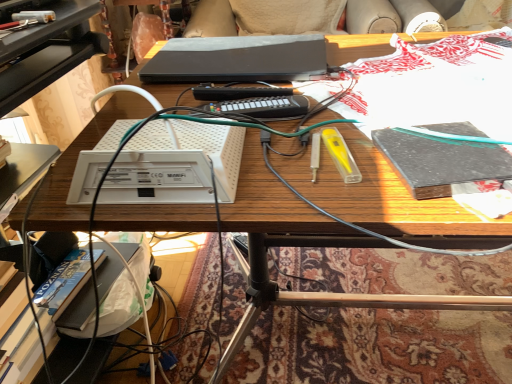
Question: Can you confirm if white plastic router at center is shorter than black matte book at right?

Choices:
 (A) no
 (B) yes

Answer: (A)

Question: Does white plastic router at center come in front of black matte book at right?

Choices:
 (A) yes
 (B) no

Answer: (A)

Question: Considering the relative sizes of white plastic router at center and black matte book at right in the image provided, is white plastic router at center wider than black matte book at right?

Choices:
 (A) no
 (B) yes

Answer: (B)

Question: Can you confirm if white plastic router at center is positioned to the right of black matte book at right?

Choices:
 (A) no
 (B) yes

Answer: (A)

Question: Is black matte book at right at the back of white plastic router at center?

Choices:
 (A) yes
 (B) no

Answer: (B)

Question: Could you tell me if white plastic router at center is turned towards black matte book at right?

Choices:
 (A) yes
 (B) no

Answer: (B)

Question: Is black matte book at right smaller than black matte laptop at center?

Choices:
 (A) no
 (B) yes

Answer: (B)

Question: Does black matte book at right lie in front of black matte laptop at center?

Choices:
 (A) yes
 (B) no

Answer: (A)

Question: Is black matte book at right oriented towards black matte laptop at center?

Choices:
 (A) yes
 (B) no

Answer: (B)

Question: From the image's perspective, does black matte book at right appear lower than black matte laptop at center?

Choices:
 (A) no
 (B) yes

Answer: (B)

Question: Is black matte book at right further to the viewer compared to black matte laptop at center?

Choices:
 (A) no
 (B) yes

Answer: (A)

Question: Considering the relative positions of black matte book at right and black matte laptop at center in the image provided, is black matte book at right to the right of black matte laptop at center from the viewer's perspective?

Choices:
 (A) yes
 (B) no

Answer: (A)

Question: Could white plastic router at center be considered to be inside black matte book at right?

Choices:
 (A) no
 (B) yes

Answer: (A)